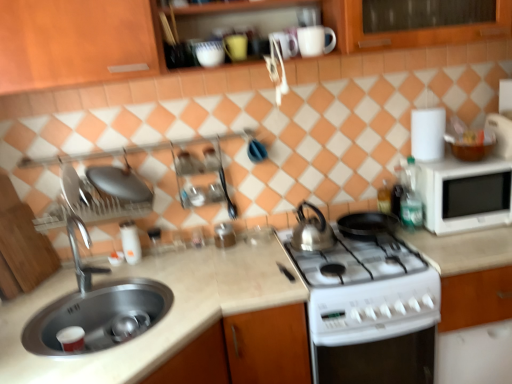
Question: Can you confirm if white glossy mug at upper center, the first mug viewed from the right, is wider than white matte countertop at center?

Choices:
 (A) no
 (B) yes

Answer: (A)

Question: From the image's perspective, is white glossy mug at upper center, the second mug when ordered from left to right, above white matte countertop at center?

Choices:
 (A) no
 (B) yes

Answer: (B)

Question: Is white glossy mug at upper center, the second mug when ordered from left to right, outside of white matte countertop at center?

Choices:
 (A) yes
 (B) no

Answer: (A)

Question: Is white glossy mug at upper center, the second mug when ordered from left to right, next to white matte countertop at center?

Choices:
 (A) no
 (B) yes

Answer: (A)

Question: From the image's perspective, is white glossy mug at upper center, the first mug viewed from the right, located beneath white matte countertop at center?

Choices:
 (A) no
 (B) yes

Answer: (A)

Question: Based on their positions, is white matte microwave at right located to the left or right of glossy ceramic mug at upper center, which appears as the 2th mug when viewed from the right?

Choices:
 (A) right
 (B) left

Answer: (A)

Question: Considering the positions of white matte microwave at right and glossy ceramic mug at upper center, the 1th mug in the left-to-right sequence, in the image, is white matte microwave at right taller or shorter than glossy ceramic mug at upper center, the 1th mug in the left-to-right sequence,?

Choices:
 (A) short
 (B) tall

Answer: (B)

Question: Is white matte microwave at right inside the boundaries of glossy ceramic mug at upper center, which appears as the 2th mug when viewed from the right, or outside?

Choices:
 (A) outside
 (B) inside

Answer: (A)

Question: In terms of size, does white matte microwave at right appear bigger or smaller than glossy ceramic mug at upper center, the 1th mug in the left-to-right sequence?

Choices:
 (A) big
 (B) small

Answer: (A)

Question: From a real-world perspective, is silver metallic sink at lower left above or below green glass bottle at right, the second bottle positioned from the back?

Choices:
 (A) below
 (B) above

Answer: (A)

Question: Does point (30, 339) appear closer or farther from the camera than point (414, 185)?

Choices:
 (A) farther
 (B) closer

Answer: (B)

Question: Considering the positions of silver metallic sink at lower left and green glass bottle at right, the second bottle positioned from the back, in the image, is silver metallic sink at lower left wider or thinner than green glass bottle at right, the second bottle positioned from the back,?

Choices:
 (A) thin
 (B) wide

Answer: (B)

Question: Is silver metallic sink at lower left taller or shorter than green glass bottle at right, which is the 1th bottle from front to back?

Choices:
 (A) short
 (B) tall

Answer: (B)

Question: Based on their sizes in the image, would you say white glossy stove at lower center is bigger or smaller than glossy ceramic mug at upper center, which appears as the 2th mug when viewed from the right?

Choices:
 (A) big
 (B) small

Answer: (A)

Question: Would you say white glossy stove at lower center is to the left or to the right of glossy ceramic mug at upper center, which appears as the 2th mug when viewed from the right, in the picture?

Choices:
 (A) left
 (B) right

Answer: (B)